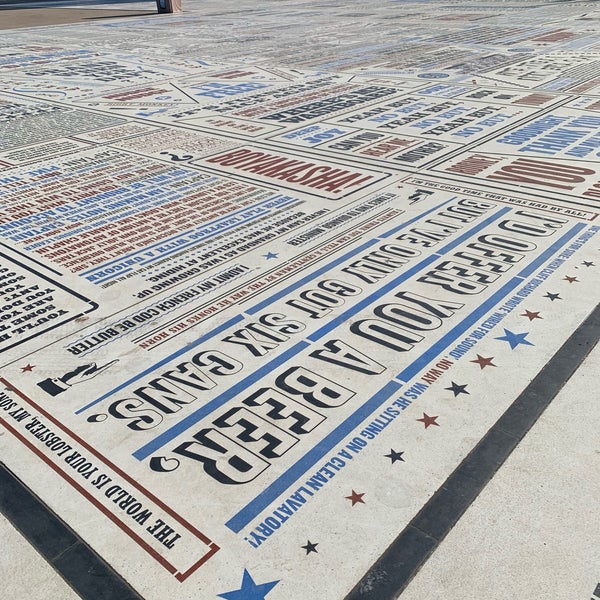
Locate an element on the screen. The width and height of the screenshot is (600, 600). floor is located at coordinates (419, 397).